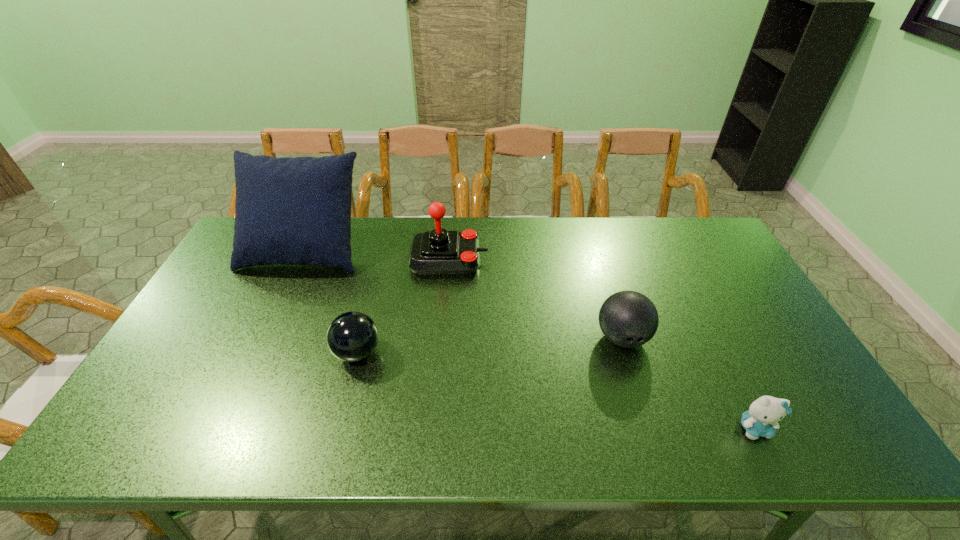
The width and height of the screenshot is (960, 540). In order to click on free space between the left bowling ball and the right bowling ball in this screenshot , I will do `click(490, 345)`.

You are a GUI agent. You are given a task and a screenshot of the screen. Output one action in this format:
    pyautogui.click(x=<x>, y=<y>)
    Task: Click on the empty location between the third object from left to right and the tallest object
    
    Given the screenshot: What is the action you would take?
    pyautogui.click(x=377, y=253)

Find the location of a particular element. Image resolution: width=960 pixels, height=540 pixels. free space between the cushion and the shortest object is located at coordinates [x=530, y=338].

Find the location of a particular element. The height and width of the screenshot is (540, 960). vacant space in between the right bowling ball and the shorter bowling ball is located at coordinates point(490,345).

Locate an element on the screen. object that is the closest to the right bowling ball is located at coordinates (761, 419).

Where is `object that stands as the second closest to the fourth object from left to right`? object that stands as the second closest to the fourth object from left to right is located at coordinates (437, 252).

Where is `vacant point that satisfies the following two spatial constraints: 1. on the grip area of the right bowling ball; 2. on the side of the shorter bowling ball with the finger holes`? vacant point that satisfies the following two spatial constraints: 1. on the grip area of the right bowling ball; 2. on the side of the shorter bowling ball with the finger holes is located at coordinates (627, 353).